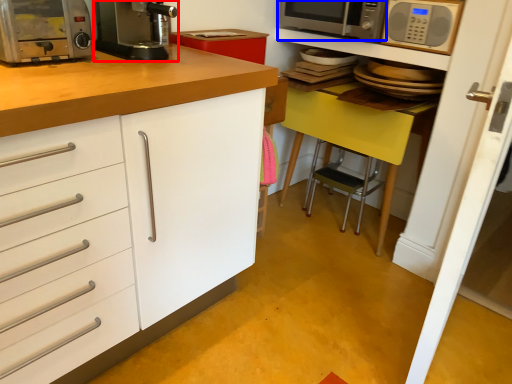
Question: Among these objects, which one is farthest to the camera, kitchen appliance (highlighted by a red box) or microwave oven (highlighted by a blue box)?

Choices:
 (A) kitchen appliance
 (B) microwave oven

Answer: (B)